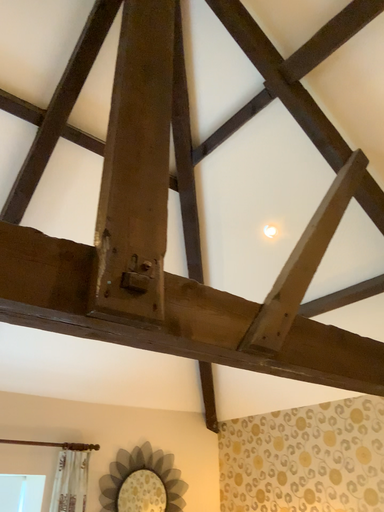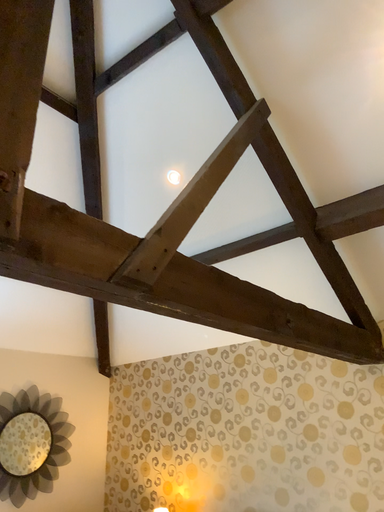
Question: How did the camera likely rotate when shooting the video?

Choices:
 (A) rotated downward
 (B) rotated upward

Answer: (A)